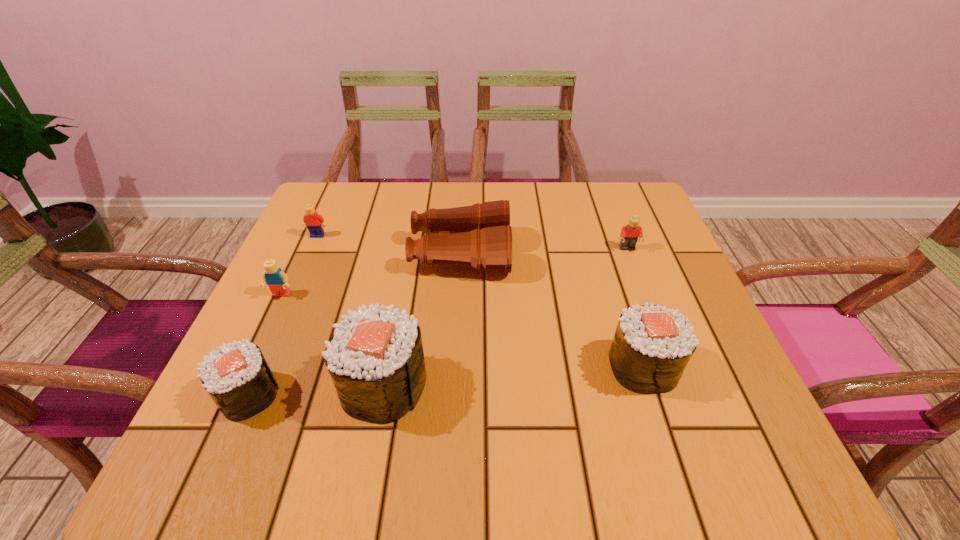
Locate an element on the screen. vacant space situated on the back of the rightmost sushi is located at coordinates (604, 249).

Where is `vacant position located 0.240m through the lenses of the binoculars`? vacant position located 0.240m through the lenses of the binoculars is located at coordinates (610, 254).

Locate an element on the screen. This screenshot has width=960, height=540. vacant region located on the front-facing side of the nearest Lego is located at coordinates (265, 329).

The width and height of the screenshot is (960, 540). Find the location of `vacant space located 0.380m on the face of the rightmost Lego`. vacant space located 0.380m on the face of the rightmost Lego is located at coordinates (683, 393).

The height and width of the screenshot is (540, 960). In order to click on vacant space located 0.180m on the face of the farthest Lego in this screenshot , I will do `click(294, 289)`.

You are a GUI agent. You are given a task and a screenshot of the screen. Output one action in this format:
    pyautogui.click(x=<x>, y=<y>)
    Task: Click on the binoculars present at the far edge
    This screenshot has height=540, width=960.
    Given the screenshot: What is the action you would take?
    pyautogui.click(x=479, y=236)

I want to click on Lego that is at the far edge, so tap(315, 223).

This screenshot has height=540, width=960. I want to click on sushi that is at the left edge, so click(x=237, y=377).

Identify the location of sushi that is at the right edge. (652, 345).

Identify the location of Lego situated at the right edge. (629, 235).